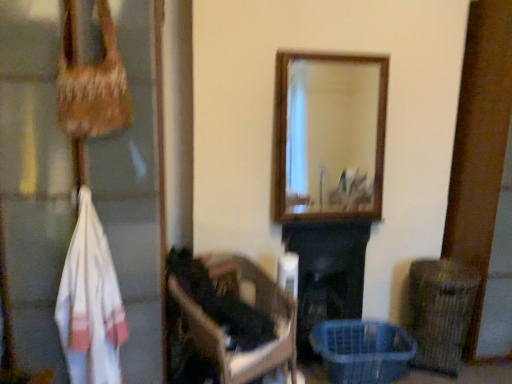
Question: Is black matte fireplace at center shorter than translucent plastic basket at lower right?

Choices:
 (A) yes
 (B) no

Answer: (B)

Question: Does black matte fireplace at center contain translucent plastic basket at lower right?

Choices:
 (A) yes
 (B) no

Answer: (B)

Question: Is black matte fireplace at center facing towards translucent plastic basket at lower right?

Choices:
 (A) no
 (B) yes

Answer: (B)

Question: Would you say black matte fireplace at center is outside translucent plastic basket at lower right?

Choices:
 (A) no
 (B) yes

Answer: (B)

Question: Are black matte fireplace at center and translucent plastic basket at lower right located far from each other?

Choices:
 (A) no
 (B) yes

Answer: (A)

Question: Is black matte fireplace at center behind translucent plastic basket at lower right?

Choices:
 (A) no
 (B) yes

Answer: (B)

Question: From the image's perspective, is translucent plastic basket at lower right beneath brown wicker basket at lower right?

Choices:
 (A) yes
 (B) no

Answer: (A)

Question: Is translucent plastic basket at lower right closer to camera compared to brown wicker basket at lower right?

Choices:
 (A) yes
 (B) no

Answer: (A)

Question: Considering the relative sizes of translucent plastic basket at lower right and brown wicker basket at lower right in the image provided, is translucent plastic basket at lower right shorter than brown wicker basket at lower right?

Choices:
 (A) yes
 (B) no

Answer: (A)

Question: From a real-world perspective, is translucent plastic basket at lower right physically above brown wicker basket at lower right?

Choices:
 (A) yes
 (B) no

Answer: (B)

Question: Are translucent plastic basket at lower right and brown wicker basket at lower right far apart?

Choices:
 (A) yes
 (B) no

Answer: (B)

Question: Is translucent plastic basket at lower right positioned beyond the bounds of brown wicker basket at lower right?

Choices:
 (A) no
 (B) yes

Answer: (B)

Question: Considering the relative sizes of dark brown wooden chair at center and translucent plastic basket at lower right in the image provided, is dark brown wooden chair at center taller than translucent plastic basket at lower right?

Choices:
 (A) yes
 (B) no

Answer: (A)